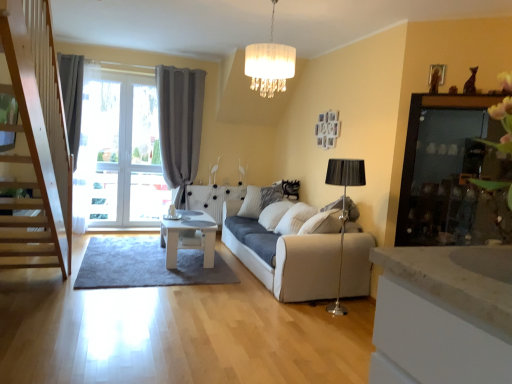
Question: Is white textured pillow at center shorter than white glossy table at center?

Choices:
 (A) yes
 (B) no

Answer: (B)

Question: Is white textured pillow at center turned away from white glossy table at center?

Choices:
 (A) yes
 (B) no

Answer: (B)

Question: Is white textured pillow at center positioned far away from white glossy table at center?

Choices:
 (A) yes
 (B) no

Answer: (A)

Question: Is white textured pillow at center placed right next to white glossy table at center?

Choices:
 (A) no
 (B) yes

Answer: (A)

Question: Is white textured pillow at center oriented towards white glossy table at center?

Choices:
 (A) no
 (B) yes

Answer: (B)

Question: Can you confirm if white textured pillow at center is wider than white glossy table at center?

Choices:
 (A) no
 (B) yes

Answer: (A)

Question: Is transparent glass screen door at upper right not near white fabric studio couch at center?

Choices:
 (A) no
 (B) yes

Answer: (B)

Question: Is transparent glass screen door at upper right looking in the opposite direction of white fabric studio couch at center?

Choices:
 (A) yes
 (B) no

Answer: (B)

Question: Is the depth of transparent glass screen door at upper right greater than that of white fabric studio couch at center?

Choices:
 (A) no
 (B) yes

Answer: (A)

Question: Does transparent glass screen door at upper right appear on the left side of white fabric studio couch at center?

Choices:
 (A) yes
 (B) no

Answer: (B)

Question: Is transparent glass screen door at upper right shorter than white fabric studio couch at center?

Choices:
 (A) yes
 (B) no

Answer: (B)

Question: From a real-world perspective, does transparent glass screen door at upper right stand above white fabric studio couch at center?

Choices:
 (A) no
 (B) yes

Answer: (B)

Question: From the image's perspective, does white fabric studio couch at center appear lower than white textured pillow at center?

Choices:
 (A) no
 (B) yes

Answer: (B)